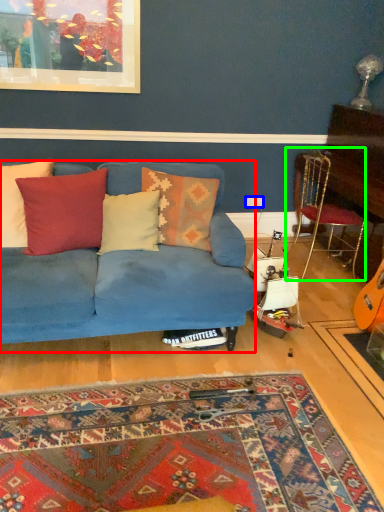
Question: Which object is positioned closest to studio couch (highlighted by a red box)? Select from power outlet (highlighted by a blue box) and chair (highlighted by a green box).

Choices:
 (A) power outlet
 (B) chair

Answer: (B)